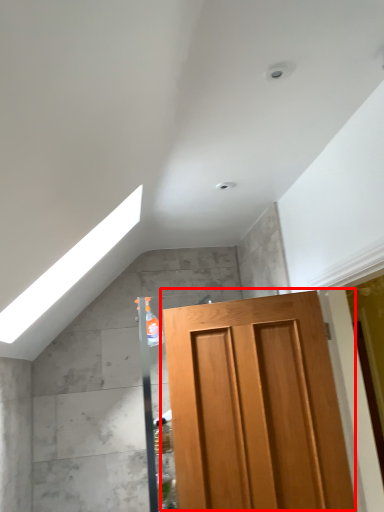
Question: From the image's perspective, where is door (annotated by the red box) located relative to exhaust hood?

Choices:
 (A) below
 (B) above

Answer: (A)